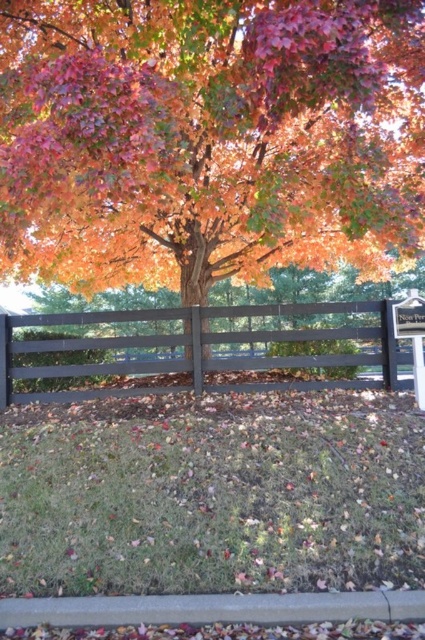
Is autumn leaves at center wider than smooth dark brown fence at center?

Indeed, autumn leaves at center has a greater width compared to smooth dark brown fence at center.

Between point (45, 22) and point (385, 364), which one is positioned behind?

The point (385, 364) is more distant.

Where is `autumn leaves at center`? autumn leaves at center is located at coordinates (207, 138).